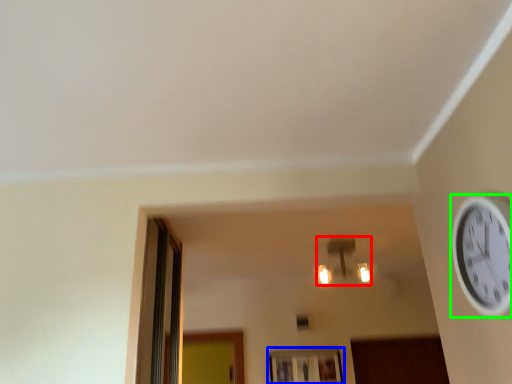
Question: Which object is the farthest from light fixture (highlighted by a red box)? Choose among these: window (highlighted by a blue box) or wall clock (highlighted by a green box).

Choices:
 (A) window
 (B) wall clock

Answer: (B)